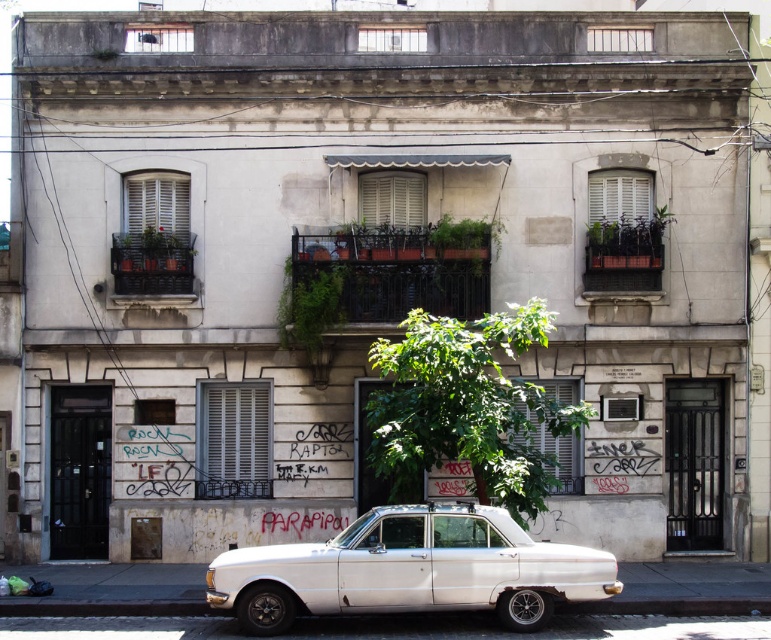
Question: In this image, where is white matte car at lower center located relative to green leafy tree at center?

Choices:
 (A) below
 (B) above

Answer: (A)

Question: Is white matte car at lower center wider than green leafy tree at center?

Choices:
 (A) no
 (B) yes

Answer: (B)

Question: Among these points, which one is farthest from the camera?

Choices:
 (A) (458, 445)
 (B) (456, 540)

Answer: (A)

Question: Which point is closer to the camera taking this photo?

Choices:
 (A) (426, 372)
 (B) (335, 577)

Answer: (B)

Question: Can you confirm if white matte car at lower center is smaller than green leafy tree at center?

Choices:
 (A) no
 (B) yes

Answer: (B)